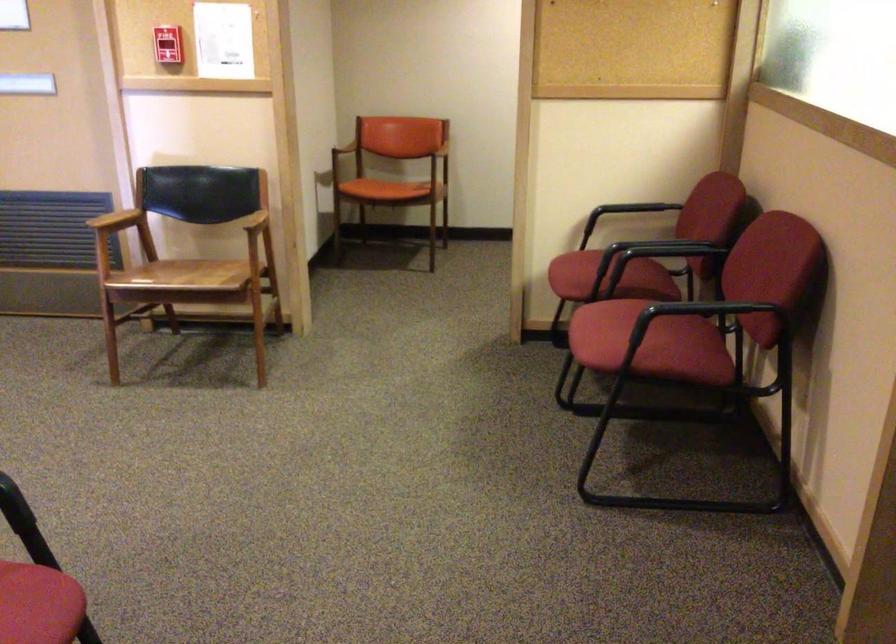
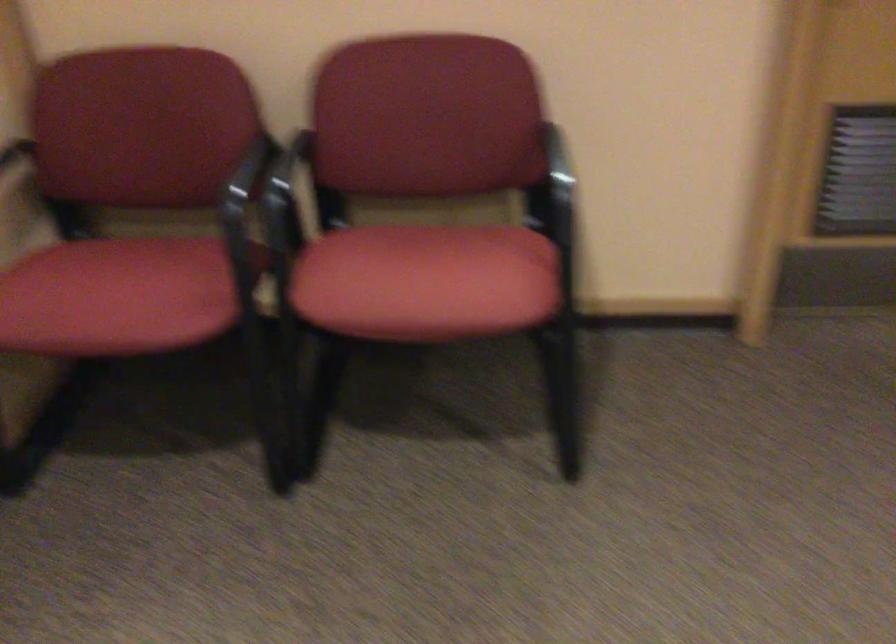
Where in the second image is the point corresponding to (x=572, y=265) from the first image?

(116, 297)